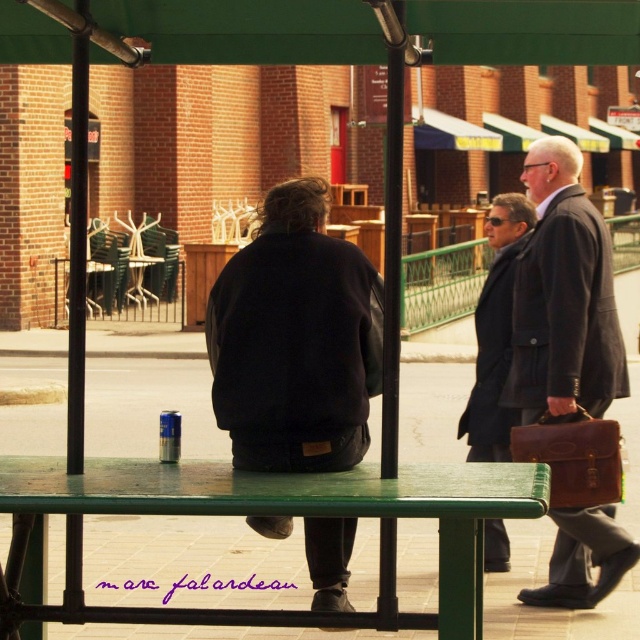
Question: Which object appears closest to the camera in this image?

Choices:
 (A) dark wool coat at center
 (B) black leather jacket at center
 (C) green painted wood picnic table at lower center

Answer: (C)

Question: Is green painted wood picnic table at lower center bigger than dark wool coat at center?

Choices:
 (A) no
 (B) yes

Answer: (A)

Question: Estimate the real-world distances between objects in this image. Which object is closer to the dark wool coat at center?

Choices:
 (A) brown leather briefcase at right
 (B) dark brown leather briefcase at right

Answer: (A)

Question: Is the position of black leather jacket at center less distant than that of brown leather briefcase at right?

Choices:
 (A) yes
 (B) no

Answer: (A)

Question: Based on their relative distances, which object is farther from the black leather jacket at center?

Choices:
 (A) dark wool coat at center
 (B) brown leather briefcase at right

Answer: (B)

Question: Is dark brown leather briefcase at right wider than dark wool coat at center?

Choices:
 (A) yes
 (B) no

Answer: (B)